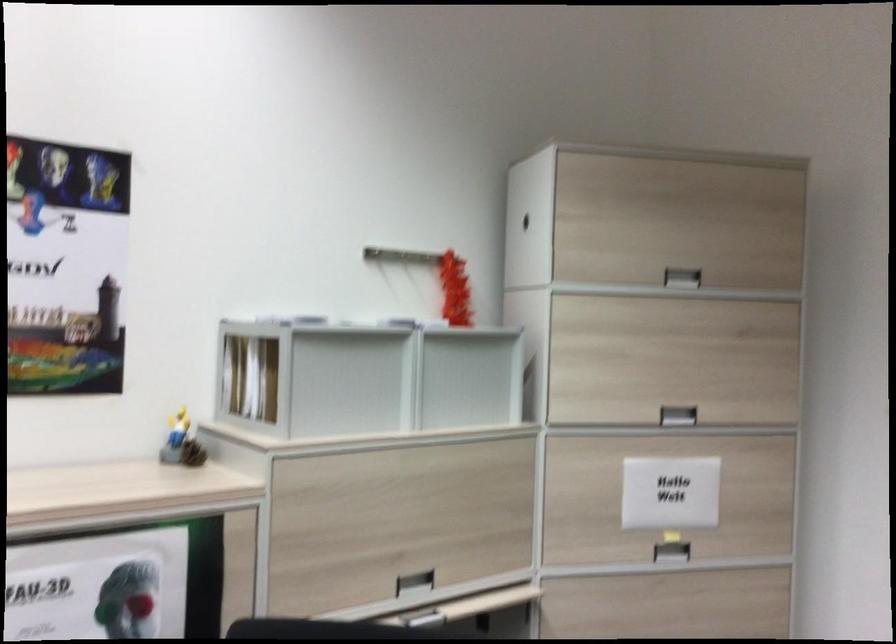
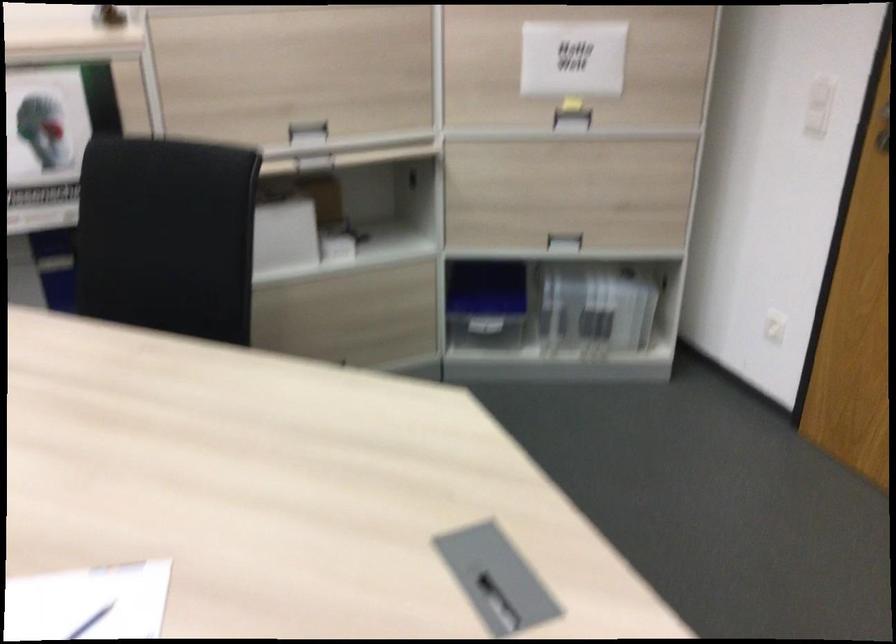
In the second image, find the point that corresponds to [677,551] in the first image.

(572, 120)